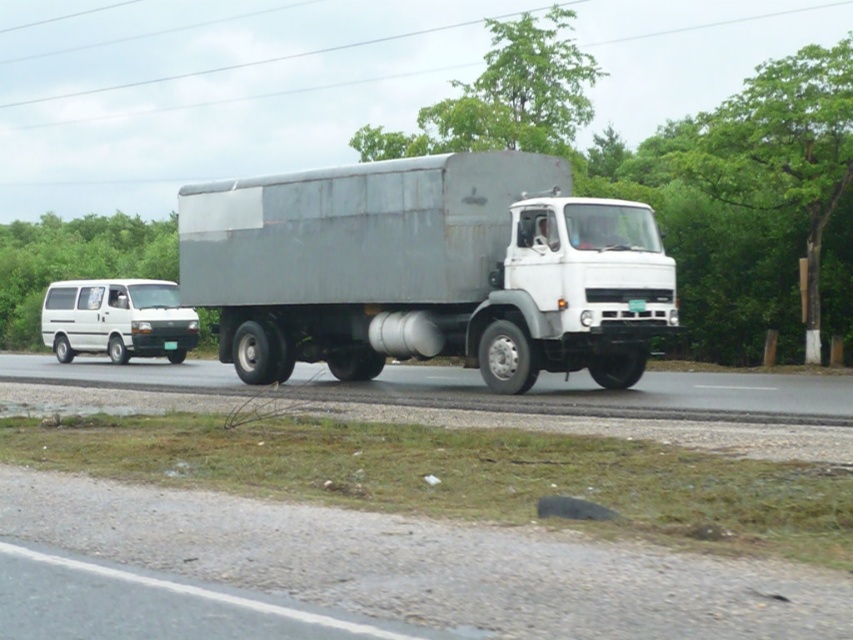
You are driving a car and want to overtake the white matte van at left. Based on the scene, can you safely pass the van using the smooth asphalt road at center?

The smooth asphalt road at center is in front of the white matte van at left, so you can safely pass the van by moving onto the road ahead.

You are a delivery driver who needs to make a quick stop. You see the point at coordinates (485,388) on the road. Is this point on a smooth surface that can support sudden braking?

The point at coordinates (485,388) indicates smooth asphalt road at center, so yes, this point is on a smooth surface that can support sudden braking.